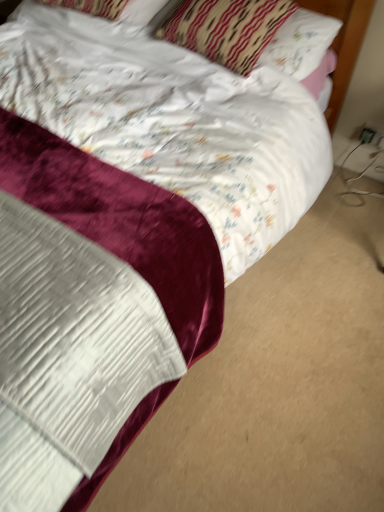
Question: Considering the relative sizes of white plastic electric outlet at lower right, marked as the first electric outlet in a right-to-left arrangement, and patterned fabric pillow at upper center, which appears as the 2th pillow when viewed from the left, in the image provided, is white plastic electric outlet at lower right, marked as the first electric outlet in a right-to-left arrangement, thinner than patterned fabric pillow at upper center, which appears as the 2th pillow when viewed from the left,?

Choices:
 (A) yes
 (B) no

Answer: (A)

Question: Is white plastic electric outlet at lower right, which appears as the 2th electric outlet when viewed from the left, aimed at patterned fabric pillow at upper center, which appears as the 2th pillow when viewed from the left?

Choices:
 (A) yes
 (B) no

Answer: (B)

Question: Is white plastic electric outlet at lower right, marked as the first electric outlet in a right-to-left arrangement, not inside patterned fabric pillow at upper center, which is the first pillow in right-to-left order?

Choices:
 (A) yes
 (B) no

Answer: (A)

Question: From a real-world perspective, is white plastic electric outlet at lower right, marked as the first electric outlet in a right-to-left arrangement, located higher than patterned fabric pillow at upper center, which is the first pillow in right-to-left order?

Choices:
 (A) yes
 (B) no

Answer: (B)

Question: From the image's perspective, is white plastic electric outlet at lower right, marked as the first electric outlet in a right-to-left arrangement, beneath patterned fabric pillow at upper center, which appears as the 2th pillow when viewed from the left?

Choices:
 (A) no
 (B) yes

Answer: (B)

Question: Does white plastic electric outlet at lower right, which appears as the 2th electric outlet when viewed from the left, contain patterned fabric pillow at upper center, which is the first pillow in right-to-left order?

Choices:
 (A) no
 (B) yes

Answer: (A)

Question: Is white satin pillow at upper center, which is the 2th pillow from right to left, shorter than patterned fabric pillow at upper center, which appears as the 2th pillow when viewed from the left?

Choices:
 (A) yes
 (B) no

Answer: (A)

Question: Considering the relative sizes of white satin pillow at upper center, which is the 2th pillow from right to left, and patterned fabric pillow at upper center, which is the first pillow in right-to-left order, in the image provided, is white satin pillow at upper center, which is the 2th pillow from right to left, taller than patterned fabric pillow at upper center, which is the first pillow in right-to-left order,?

Choices:
 (A) no
 (B) yes

Answer: (A)

Question: From a real-world perspective, is white satin pillow at upper center, which is counted as the 1th pillow, starting from the left, beneath patterned fabric pillow at upper center, which is the first pillow in right-to-left order?

Choices:
 (A) no
 (B) yes

Answer: (B)

Question: Are white satin pillow at upper center, which is the 2th pillow from right to left, and patterned fabric pillow at upper center, which appears as the 2th pillow when viewed from the left, far apart?

Choices:
 (A) yes
 (B) no

Answer: (B)

Question: Is white satin pillow at upper center, which is counted as the 1th pillow, starting from the left, further to the viewer compared to patterned fabric pillow at upper center, which is the first pillow in right-to-left order?

Choices:
 (A) no
 (B) yes

Answer: (B)

Question: Considering the relative sizes of white satin pillow at upper center, which is the 2th pillow from right to left, and patterned fabric pillow at upper center, which appears as the 2th pillow when viewed from the left, in the image provided, is white satin pillow at upper center, which is the 2th pillow from right to left, thinner than patterned fabric pillow at upper center, which appears as the 2th pillow when viewed from the left,?

Choices:
 (A) no
 (B) yes

Answer: (B)

Question: Considering the relative sizes of black plastic outlet at lower right, the 1th electric outlet positioned from the left, and white plastic electric outlet at lower right, which appears as the 2th electric outlet when viewed from the left, in the image provided, is black plastic outlet at lower right, the 1th electric outlet positioned from the left, taller than white plastic electric outlet at lower right, which appears as the 2th electric outlet when viewed from the left,?

Choices:
 (A) no
 (B) yes

Answer: (A)